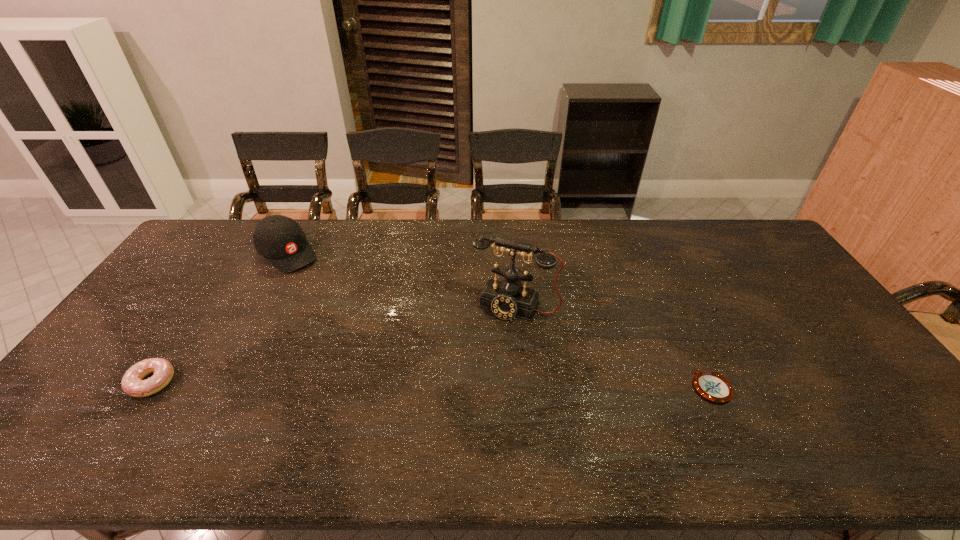
The width and height of the screenshot is (960, 540). What are the coordinates of `doughnut` in the screenshot? It's located at (132, 383).

Where is `the third tallest object`? the third tallest object is located at coordinates (132, 383).

Where is `compass`? The image size is (960, 540). compass is located at coordinates (712, 386).

Locate an element on the screen. the shortest object is located at coordinates (712, 386).

Image resolution: width=960 pixels, height=540 pixels. I want to click on telephone, so click(x=507, y=299).

Find the location of `the tallest object`. the tallest object is located at coordinates (507, 299).

Locate an element on the screen. The height and width of the screenshot is (540, 960). the third shortest object is located at coordinates (279, 239).

Find the location of a particular element. Image resolution: width=960 pixels, height=540 pixels. baseball cap is located at coordinates (279, 239).

The width and height of the screenshot is (960, 540). In order to click on vacant space located 0.340m on the back of the doughnut in this screenshot , I will do `click(220, 281)`.

Where is `vacant space located 0.400m on the right of the shortest object`? This screenshot has height=540, width=960. vacant space located 0.400m on the right of the shortest object is located at coordinates (887, 387).